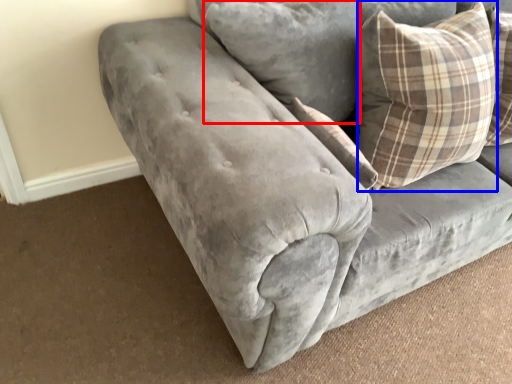
Question: Which of the following is the closest to the observer, pillow (highlighted by a red box) or pillow (highlighted by a blue box)?

Choices:
 (A) pillow
 (B) pillow

Answer: (B)